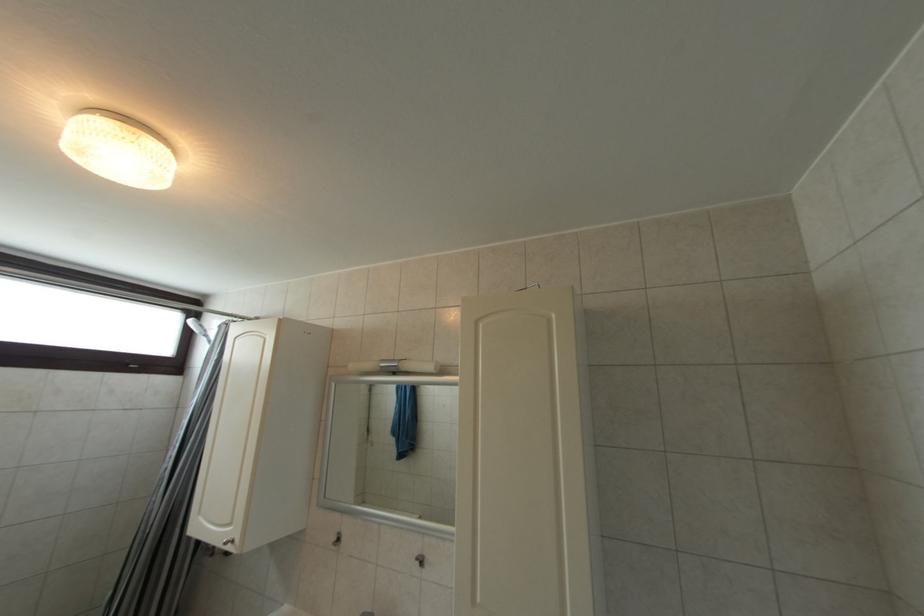
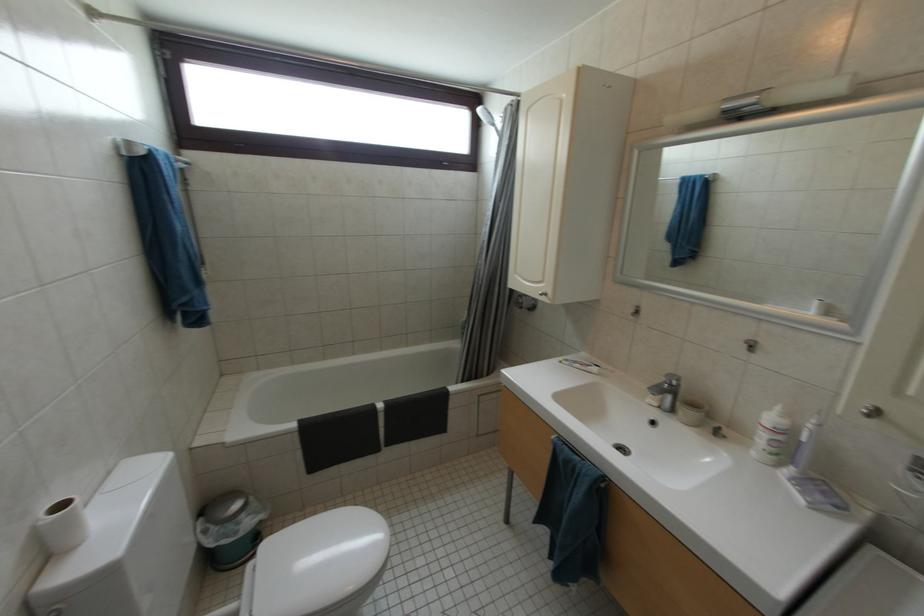
The images are taken continuously from a first-person perspective. In which direction is your viewpoint rotating?

The rotation direction of the camera is left-down.